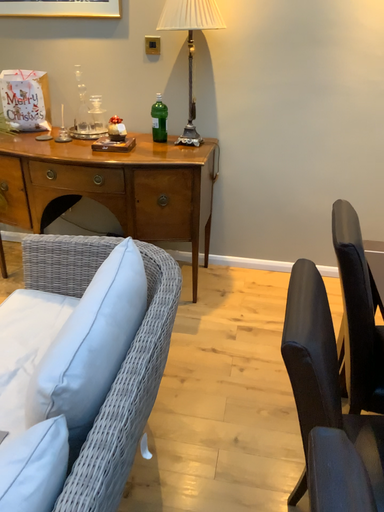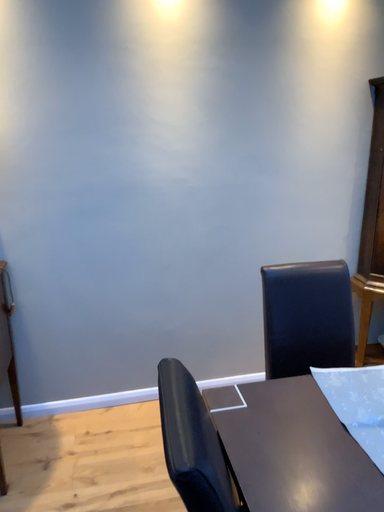
Question: Which way did the camera rotate in the video?

Choices:
 (A) rotated left
 (B) rotated right

Answer: (B)